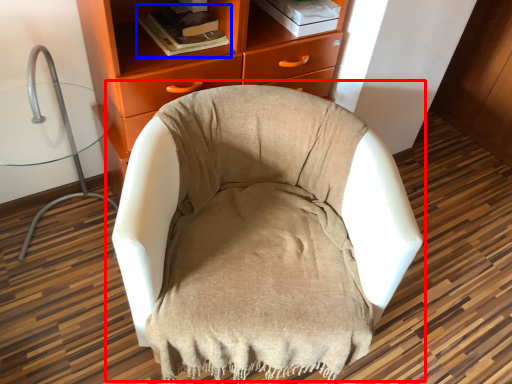
Question: Which object appears closest to the camera in this image, chair (highlighted by a red box) or book (highlighted by a blue box)?

Choices:
 (A) chair
 (B) book

Answer: (A)